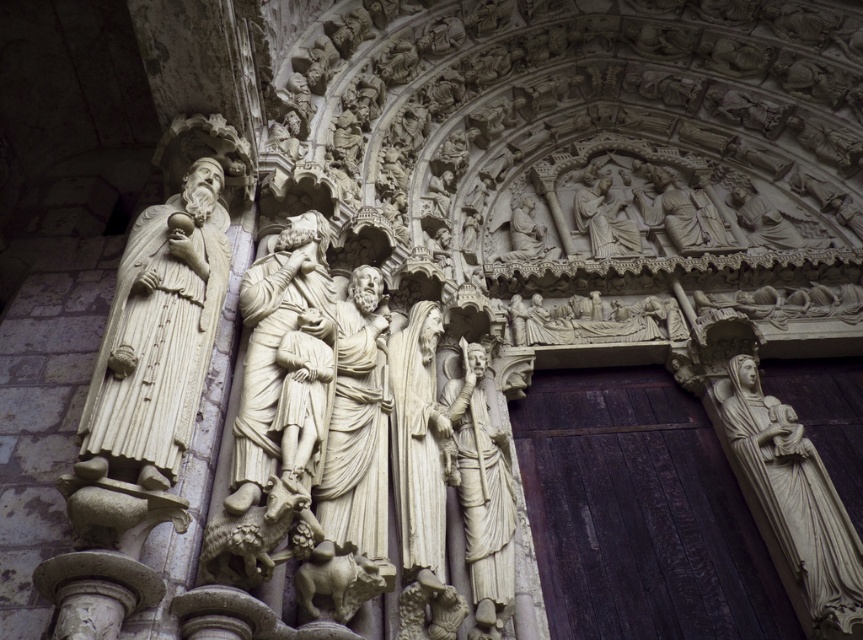
Can you confirm if white marble statue at left is shorter than white marble statue at center?

No, white marble statue at left is not shorter than white marble statue at center.

Between point (118, 396) and point (276, 404), which one is positioned behind?

The point (276, 404) is behind.

At what (x,y) coordinates should I click in order to perform the action: click on white marble statue at left. Please return your answer as a coordinate pair (x, y). The image size is (863, 640). Looking at the image, I should click on (159, 330).

Can you confirm if white marble statue at center is taller than white marble statue at center-right?

No, white marble statue at center is not taller than white marble statue at center-right.

Between point (252, 349) and point (479, 589), which one is positioned behind?

Positioned behind is point (479, 589).

At what (x,y) coordinates should I click in order to perform the action: click on white marble statue at center. Please return your answer as a coordinate pair (x, y). This screenshot has width=863, height=640. Looking at the image, I should click on (276, 348).

Does dark wood door at right appear under white marble statue at right?

Indeed, dark wood door at right is positioned under white marble statue at right.

Which is more to the right, dark wood door at right or white marble statue at right?

white marble statue at right

Is point (644, 570) behind point (822, 476)?

Yes, it is.

Locate an element on the screen. Image resolution: width=863 pixels, height=640 pixels. dark wood door at right is located at coordinates (639, 513).